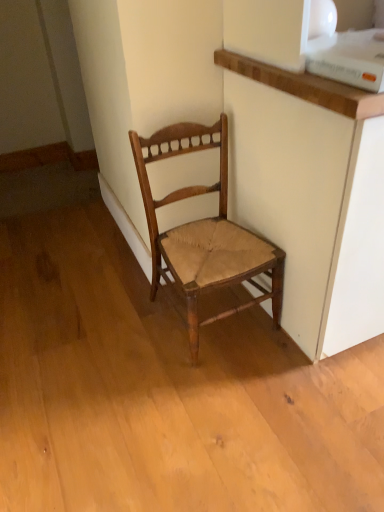
Question: Is matte white cabinet at upper right positioned far away from wooden woven seat chair at center?

Choices:
 (A) no
 (B) yes

Answer: (A)

Question: Is matte white cabinet at upper right positioned before wooden woven seat chair at center?

Choices:
 (A) yes
 (B) no

Answer: (A)

Question: Does matte white cabinet at upper right have a lesser height compared to wooden woven seat chair at center?

Choices:
 (A) yes
 (B) no

Answer: (B)

Question: Considering the relative sizes of matte white cabinet at upper right and wooden woven seat chair at center in the image provided, is matte white cabinet at upper right thinner than wooden woven seat chair at center?

Choices:
 (A) no
 (B) yes

Answer: (A)

Question: Is matte white cabinet at upper right outside wooden woven seat chair at center?

Choices:
 (A) yes
 (B) no

Answer: (A)

Question: From the image's perspective, would you say matte white cabinet at upper right is shown under wooden woven seat chair at center?

Choices:
 (A) no
 (B) yes

Answer: (A)

Question: Considering the relative sizes of wooden woven seat chair at center and matte white cabinet at upper right in the image provided, is wooden woven seat chair at center bigger than matte white cabinet at upper right?

Choices:
 (A) yes
 (B) no

Answer: (B)

Question: Is wooden woven seat chair at center wider than matte white cabinet at upper right?

Choices:
 (A) no
 (B) yes

Answer: (A)

Question: Is wooden woven seat chair at center with matte white cabinet at upper right?

Choices:
 (A) yes
 (B) no

Answer: (B)

Question: Does wooden woven seat chair at center have a greater height compared to matte white cabinet at upper right?

Choices:
 (A) yes
 (B) no

Answer: (B)

Question: Is wooden woven seat chair at center in front of matte white cabinet at upper right?

Choices:
 (A) no
 (B) yes

Answer: (A)

Question: From the image's perspective, is wooden woven seat chair at center over matte white cabinet at upper right?

Choices:
 (A) no
 (B) yes

Answer: (A)

Question: In the image, is matte white cabinet at upper right positioned in front of or behind wooden woven seat chair at center?

Choices:
 (A) front
 (B) behind

Answer: (A)